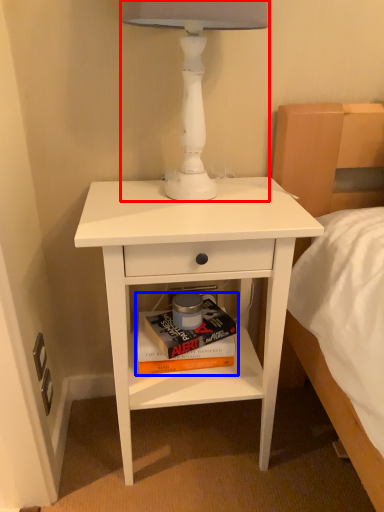
Question: Which object is closer to the camera taking this photo, table lamp (highlighted by a red box) or paperback book (highlighted by a blue box)?

Choices:
 (A) table lamp
 (B) paperback book

Answer: (A)